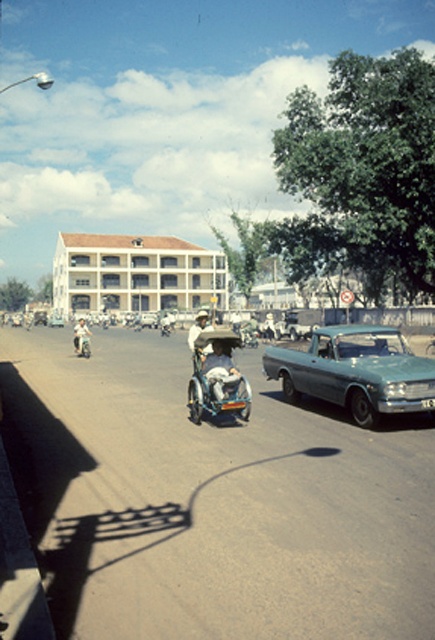
Question: Does teal metallic car at right come behind light brown leather jacket at center?

Choices:
 (A) yes
 (B) no

Answer: (A)

Question: Estimate the real-world distances between objects in this image. Which object is farther from the light brown leather jacket at center?

Choices:
 (A) light brown leather helmet at center
 (B) teal metallic car at right
 (C) white leather helmet at center

Answer: (B)

Question: Is white leather helmet at center to the left of light brown leather jacket at center from the viewer's perspective?

Choices:
 (A) yes
 (B) no

Answer: (B)

Question: Which is nearer to the white leather helmet at center?

Choices:
 (A) teal metallic car at right
 (B) light brown leather jacket at center

Answer: (B)

Question: Based on their relative distances, which object is farther from the teal metallic car at right?

Choices:
 (A) light brown leather helmet at center
 (B) light brown leather jacket at center

Answer: (B)

Question: Does white leather helmet at center have a lesser width compared to light brown leather jacket at center?

Choices:
 (A) no
 (B) yes

Answer: (B)